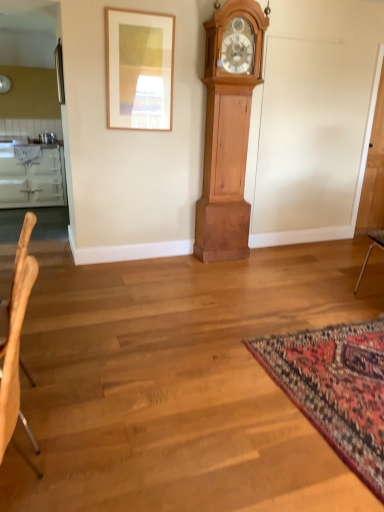
Question: Considering the positions of point (365, 370) and point (117, 9), is point (365, 370) closer or farther from the camera than point (117, 9)?

Choices:
 (A) farther
 (B) closer

Answer: (B)

Question: From a real-world perspective, is carpet with intricate patterns at lower right above or below wooden picture frame at upper center?

Choices:
 (A) above
 (B) below

Answer: (B)

Question: Which of these objects is positioned closest to the light brown wood chair at left?

Choices:
 (A) white glossy cabinetry at left
 (B) wooden picture frame at upper center
 (C) light brown wood grandfather clock at center
 (D) carpet with intricate patterns at lower right

Answer: (D)

Question: Which object is positioned closest to the carpet with intricate patterns at lower right?

Choices:
 (A) light brown wood chair at left
 (B) white glossy cabinetry at left
 (C) light brown wood grandfather clock at center
 (D) wooden picture frame at upper center

Answer: (A)